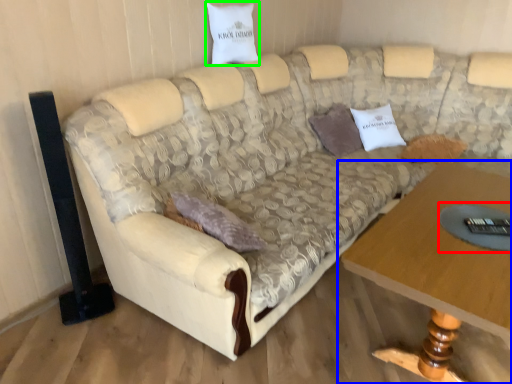
Question: Which object is the closest to the glass table (highlighted by a red box)? Choose among these: table (highlighted by a blue box) or pillow (highlighted by a green box).

Choices:
 (A) table
 (B) pillow

Answer: (A)